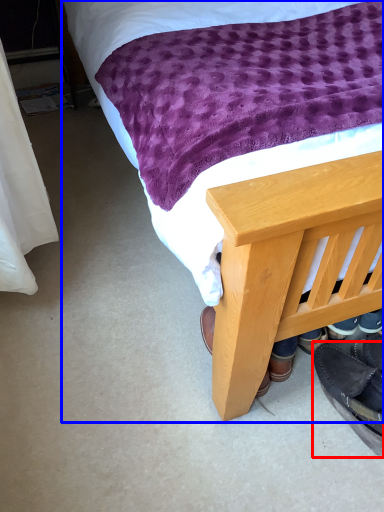
Question: Which point is closer to the camera, footwear (highlighted by a red box) or bed (highlighted by a blue box)?

Choices:
 (A) footwear
 (B) bed

Answer: (B)